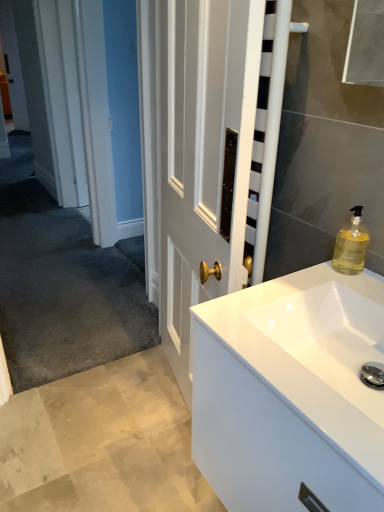
Question: Would you say translucent yellow liquid at upper right is to the left or to the right of white glossy cabinet at lower right in the picture?

Choices:
 (A) left
 (B) right

Answer: (B)

Question: From the image's perspective, is translucent yellow liquid at upper right above or below white glossy cabinet at lower right?

Choices:
 (A) above
 (B) below

Answer: (A)

Question: Is translucent yellow liquid at upper right taller or shorter than white glossy cabinet at lower right?

Choices:
 (A) short
 (B) tall

Answer: (B)

Question: Based on their sizes in the image, would you say white glossy cabinet at lower right is bigger or smaller than translucent yellow liquid at upper right?

Choices:
 (A) big
 (B) small

Answer: (A)

Question: Relative to translucent yellow liquid at upper right, is white glossy cabinet at lower right in front or behind?

Choices:
 (A) behind
 (B) front

Answer: (B)

Question: Would you say white glossy cabinet at lower right is to the left or to the right of translucent yellow liquid at upper right in the picture?

Choices:
 (A) right
 (B) left

Answer: (B)

Question: From a real-world perspective, relative to translucent yellow liquid at upper right, is white glossy cabinet at lower right vertically above or below?

Choices:
 (A) below
 (B) above

Answer: (A)